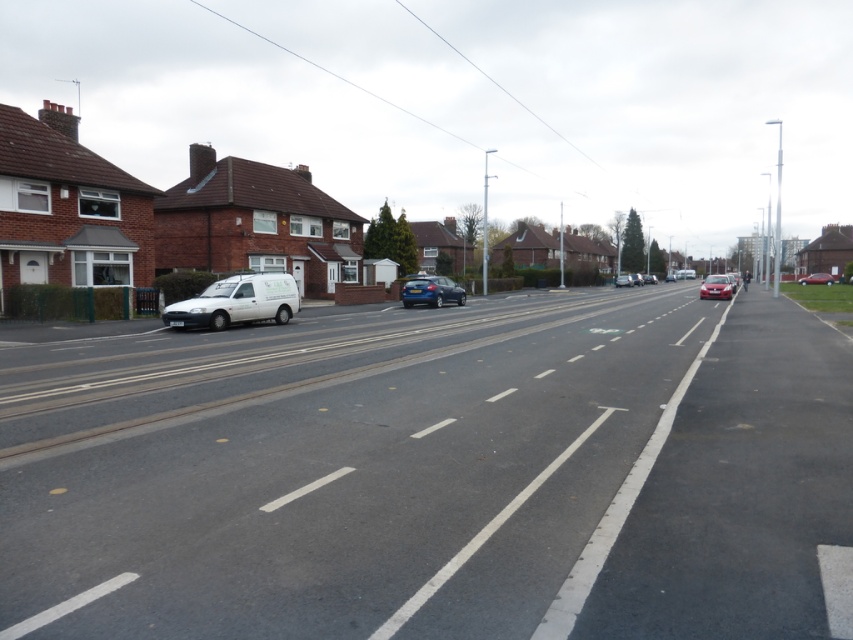
You are a pedestrian standing at the origin point of the coordinate system. You want to cross the road to reach the house on the left. The road is represented as a coordinate plane where the origin is at the bottom left corner. The x and y axes increase to the right and upwards respectively. The point you need to reach is at coordinate point (431,291). What is the shortest path you can take to reach the point without entering the road area?

The shortest path would be to move along the left side of the road to the point (431,291), staying on the sidewalk or grassy area adjacent to the houses to avoid the road area.

You are a pedestrian standing at the crosswalk and need to cross the road. You see a white matte van at left and a shiny red sedan at center. Which vehicle is closer to you?

The white matte van at left is closer to you because it is in front of the shiny red sedan at center, meaning it is positioned nearer to your location at the crosswalk.

You are a delivery driver trying to park your vehicle between the white matte van at left and the shiny red sedan at center. Your vehicle is 1.8 meters wide. Can you fit your vehicle in the space between them?

The white matte van at left is thinner than the shiny red sedan at center, but the exact width of the space between them isn not provided. Therefore, it is uncertain if your vehicle can fit.